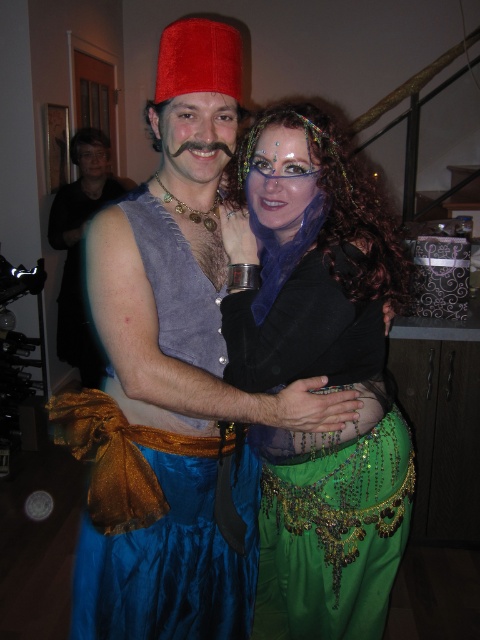
You are a photographer at a costume party and need to adjust the lighting to highlight the green sequined skirt at center and the blue satin vest at center. Which object should you focus the spotlight on first to ensure it appears higher in the frame?

The green sequined skirt at center is located above the blue satin vest at center, so you should focus the spotlight on the green sequined skirt at center first to capture its higher position in the frame.